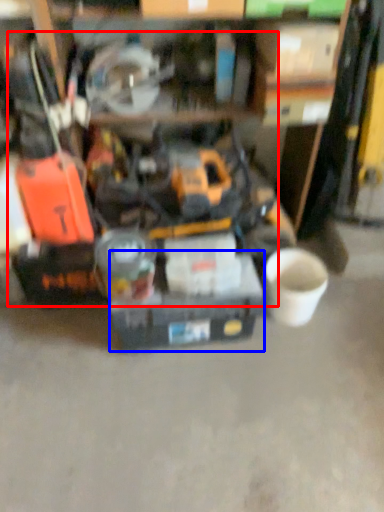
Question: Which object appears farthest to the camera in this image, tool (highlighted by a red box) or box (highlighted by a blue box)?

Choices:
 (A) tool
 (B) box

Answer: (B)